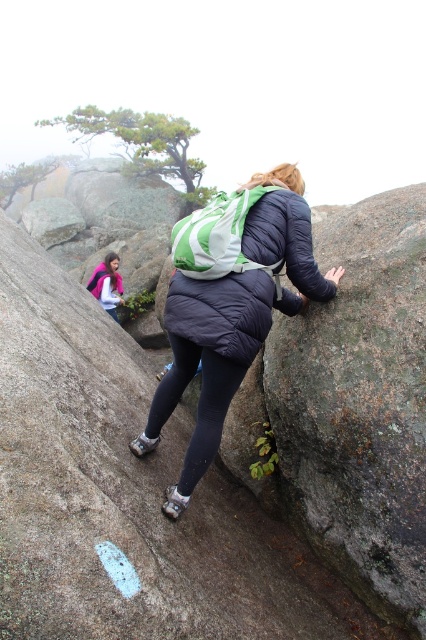
Question: Does matte blue jacket at center appear on the left side of pink fleece jacket at center?

Choices:
 (A) yes
 (B) no

Answer: (B)

Question: Which object is farther from the camera taking this photo?

Choices:
 (A) pink fleece jacket at center
 (B) matte blue jacket at center
 (C) rough granite boulder at center
 (D) matte blue down jacket at center

Answer: (A)

Question: Is rough granite boulder at center below matte blue down jacket at center?

Choices:
 (A) no
 (B) yes

Answer: (B)

Question: Based on their relative distances, which object is farther from the rough granite boulder at center?

Choices:
 (A) matte blue down jacket at center
 (B) pink fleece jacket at center
 (C) matte blue jacket at center

Answer: (B)

Question: Which point is farther to the camera?

Choices:
 (A) pink fleece jacket at center
 (B) rough granite boulder at center
 (C) matte blue down jacket at center
 (D) matte blue jacket at center

Answer: (A)

Question: From the image, what is the correct spatial relationship of matte blue down jacket at center in relation to pink fleece jacket at center?

Choices:
 (A) left
 (B) right

Answer: (B)